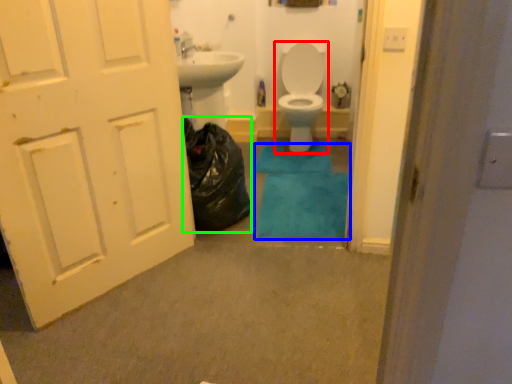
Question: Estimate the real-world distances between objects in this image. Which object is farther from toilet (highlighted by a red box), bath mat (highlighted by a blue box) or garbage (highlighted by a green box)?

Choices:
 (A) bath mat
 (B) garbage

Answer: (B)